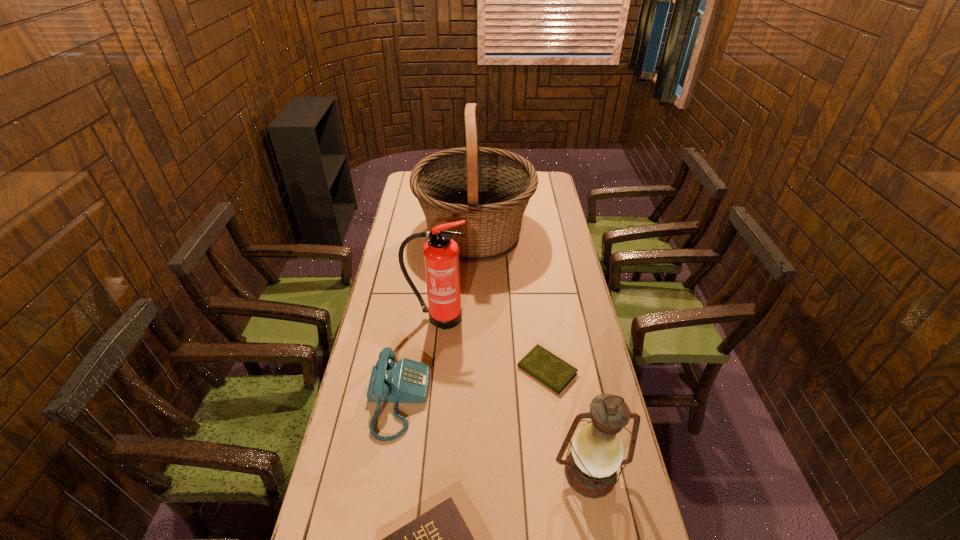
Locate an element on the screen. The width and height of the screenshot is (960, 540). vacant space located on the dial of the telephone is located at coordinates (455, 400).

This screenshot has height=540, width=960. What are the coordinates of `free space located on the back of the shortest object` in the screenshot? It's located at (539, 310).

Where is `basket located in the left edge section of the desktop`? The width and height of the screenshot is (960, 540). basket located in the left edge section of the desktop is located at coordinates (489, 188).

Where is `fire extinguisher that is at the left edge`? This screenshot has width=960, height=540. fire extinguisher that is at the left edge is located at coordinates (441, 253).

Identify the location of telephone positioned at the left edge. (407, 381).

Where is `basket that is at the right edge`? The height and width of the screenshot is (540, 960). basket that is at the right edge is located at coordinates (489, 188).

I want to click on oil lamp at the right edge, so click(591, 467).

What are the coordinates of `diary located in the right edge section of the desktop` in the screenshot? It's located at (544, 366).

Identify the location of vacant region at the left edge. (385, 463).

This screenshot has width=960, height=540. Identify the location of free space between the oil lamp and the shortest object. (568, 422).